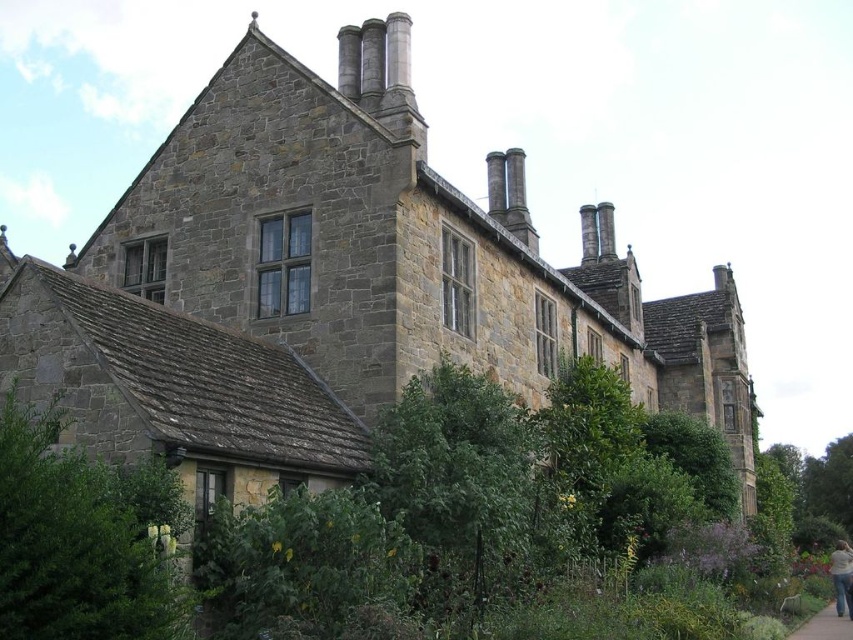
You are standing in front of the historic stone building and notice two points marked on its facade. The first point is at coordinates point (819, 616) and the second is at point (844, 572). Which of these two points is closer to you?

Point (819, 616) is in front of point (844, 572), so it is closer to you.

From the picture: You are standing in front of the historic stone building and notice two items at the lower right corner of the image. Which one is narrower between the gray concrete pavement at lower right and the light pink fabric at lower right?

The gray concrete pavement at lower right is thinner than the light pink fabric at lower right, so the gray concrete pavement at lower right is narrower.